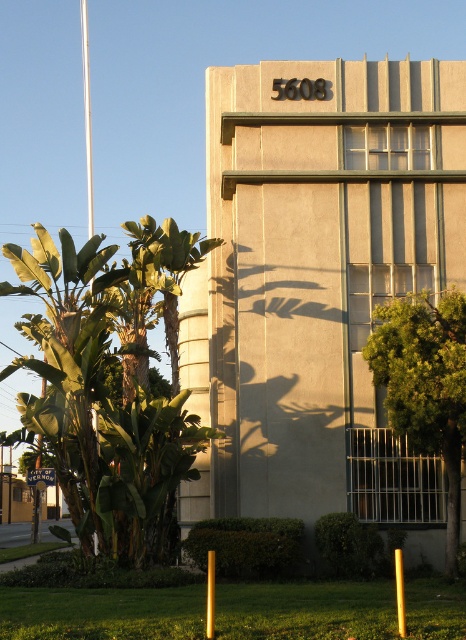
Question: Is the position of green leafy tree at left less distant than that of green leafy tree at right?

Choices:
 (A) no
 (B) yes

Answer: (A)

Question: Which object is positioned closest to the yellow plastic pole at lower center?

Choices:
 (A) green leafy tree at right
 (B) metallic pole at center
 (C) green leafy tree at left

Answer: (B)

Question: Is green leafy tree at left closer to camera compared to metallic pole at center?

Choices:
 (A) yes
 (B) no

Answer: (B)

Question: Does green leafy tree at left have a smaller size compared to metallic pole at center?

Choices:
 (A) yes
 (B) no

Answer: (B)

Question: Which point is closer to the camera taking this photo?

Choices:
 (A) click(x=213, y=566)
 (B) click(x=20, y=326)
 (C) click(x=411, y=326)

Answer: (A)

Question: Which of the following is the closest to the observer?

Choices:
 (A) green leafy tree at right
 (B) metallic pole at center
 (C) yellow plastic pole at lower center
 (D) green leafy tree at left

Answer: (B)